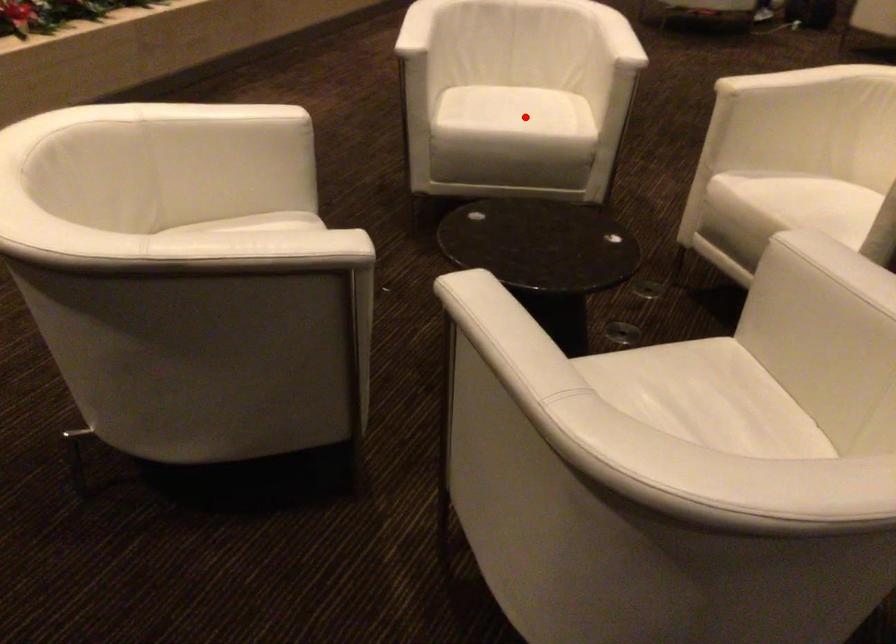
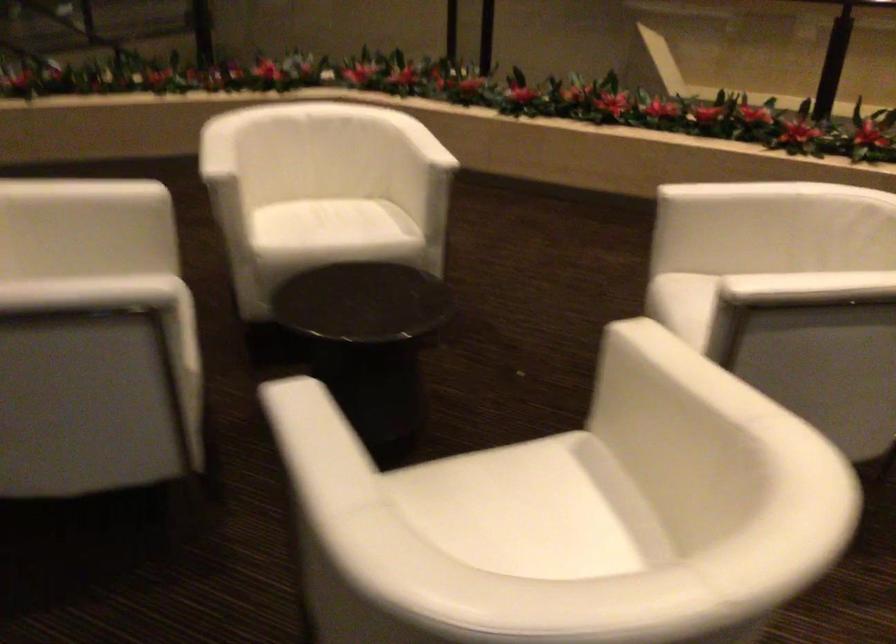
Question: I am providing you with two images of the same scene from different viewpoints. A red point is marked on the first image. Can you still see the location of the red point in image 2?

Choices:
 (A) Yes
 (B) No

Answer: (B)